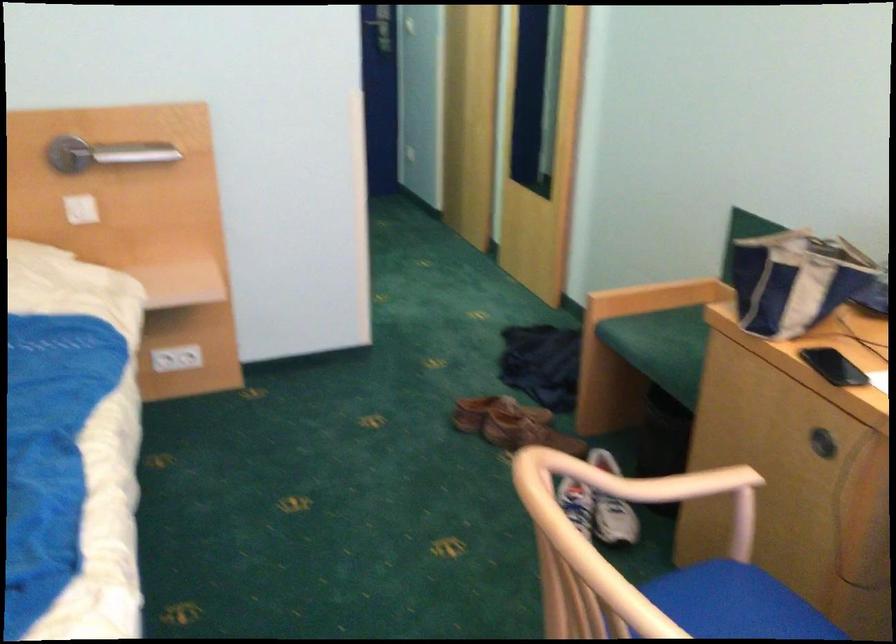
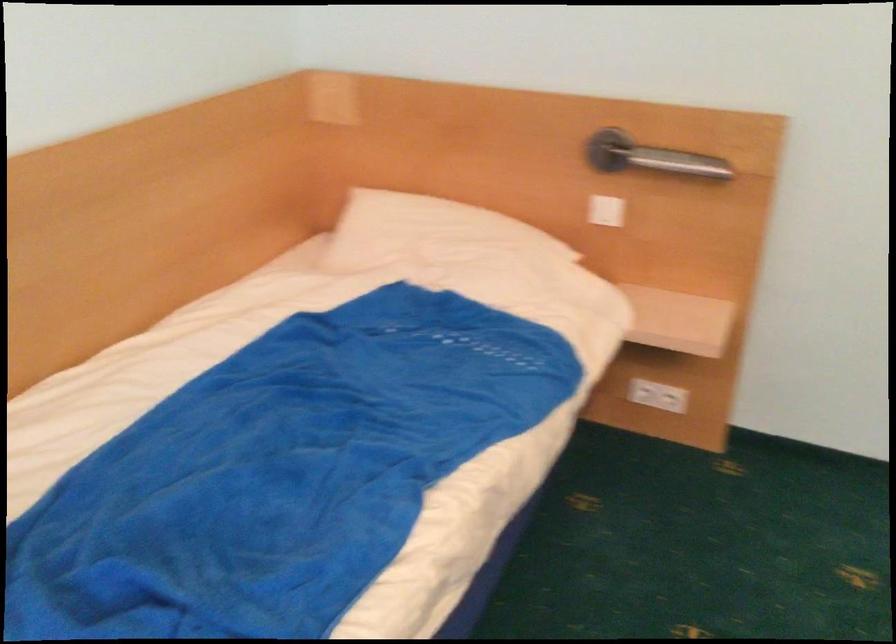
Question: How did the camera likely rotate?

Choices:
 (A) Left
 (B) Right
 (C) Up
 (D) Down

Answer: (A)